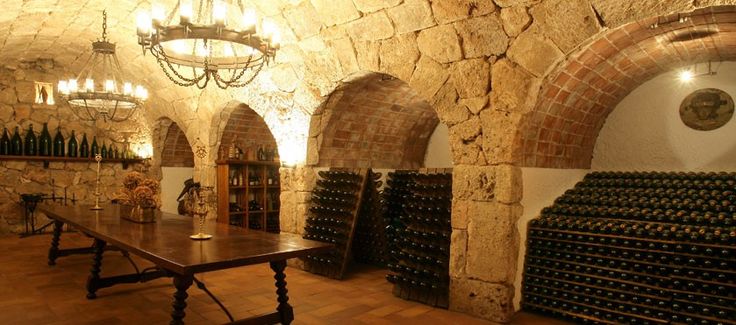
Image resolution: width=736 pixels, height=325 pixels. Identify the location of floor to left of table. (32, 290).